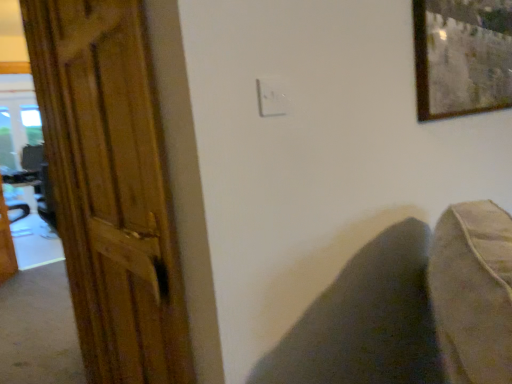
Question: Is wooden table at left shorter than white plastic electric outlet at center?

Choices:
 (A) no
 (B) yes

Answer: (A)

Question: Is wooden table at left further to the viewer compared to white plastic electric outlet at center?

Choices:
 (A) no
 (B) yes

Answer: (B)

Question: Is wooden table at left at the left side of white plastic electric outlet at center?

Choices:
 (A) no
 (B) yes

Answer: (B)

Question: From the image's perspective, is wooden table at left over white plastic electric outlet at center?

Choices:
 (A) yes
 (B) no

Answer: (B)

Question: Considering the relative sizes of wooden table at left and white plastic electric outlet at center in the image provided, is wooden table at left bigger than white plastic electric outlet at center?

Choices:
 (A) no
 (B) yes

Answer: (B)

Question: Is wooden table at left in front of white plastic electric outlet at center?

Choices:
 (A) yes
 (B) no

Answer: (B)

Question: From the image's perspective, would you say dark fabric swivel chair at lower right is positioned over white plastic electric outlet at center?

Choices:
 (A) no
 (B) yes

Answer: (A)

Question: Are dark fabric swivel chair at lower right and white plastic electric outlet at center located far from each other?

Choices:
 (A) no
 (B) yes

Answer: (A)

Question: Considering the relative sizes of dark fabric swivel chair at lower right and white plastic electric outlet at center in the image provided, is dark fabric swivel chair at lower right shorter than white plastic electric outlet at center?

Choices:
 (A) no
 (B) yes

Answer: (B)

Question: Can you confirm if dark fabric swivel chair at lower right is smaller than white plastic electric outlet at center?

Choices:
 (A) yes
 (B) no

Answer: (B)

Question: Can you confirm if dark fabric swivel chair at lower right is bigger than white plastic electric outlet at center?

Choices:
 (A) no
 (B) yes

Answer: (B)

Question: Considering the relative sizes of dark fabric swivel chair at lower right and white plastic electric outlet at center in the image provided, is dark fabric swivel chair at lower right wider than white plastic electric outlet at center?

Choices:
 (A) no
 (B) yes

Answer: (B)

Question: Does wooden table at left have a smaller size compared to dark fabric swivel chair at lower right?

Choices:
 (A) no
 (B) yes

Answer: (A)